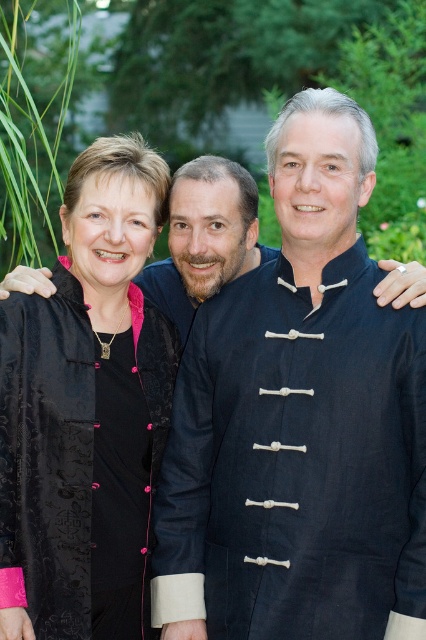
Question: Based on their relative distances, which object is farther from the dark blue fabric robe at center?

Choices:
 (A) matte black shirt at center
 (B) black satin blouse at left

Answer: (A)

Question: Does dark blue fabric robe at center have a smaller size compared to black satin blouse at left?

Choices:
 (A) no
 (B) yes

Answer: (B)

Question: Which object is positioned farthest from the matte black shirt at center?

Choices:
 (A) dark blue fabric robe at center
 (B) black satin blouse at left

Answer: (A)

Question: Estimate the real-world distances between objects in this image. Which object is farther from the black satin blouse at left?

Choices:
 (A) dark blue fabric robe at center
 (B) matte black shirt at center

Answer: (B)

Question: Is dark blue fabric robe at center bigger than matte black shirt at center?

Choices:
 (A) yes
 (B) no

Answer: (A)

Question: Is dark blue fabric robe at center above matte black shirt at center?

Choices:
 (A) yes
 (B) no

Answer: (B)